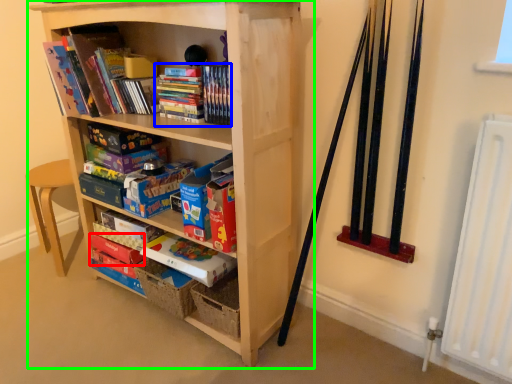
Question: Which object is the farthest from paperback book (highlighted by a red box)? Choose among these: book (highlighted by a blue box) or bookcase (highlighted by a green box).

Choices:
 (A) book
 (B) bookcase

Answer: (A)